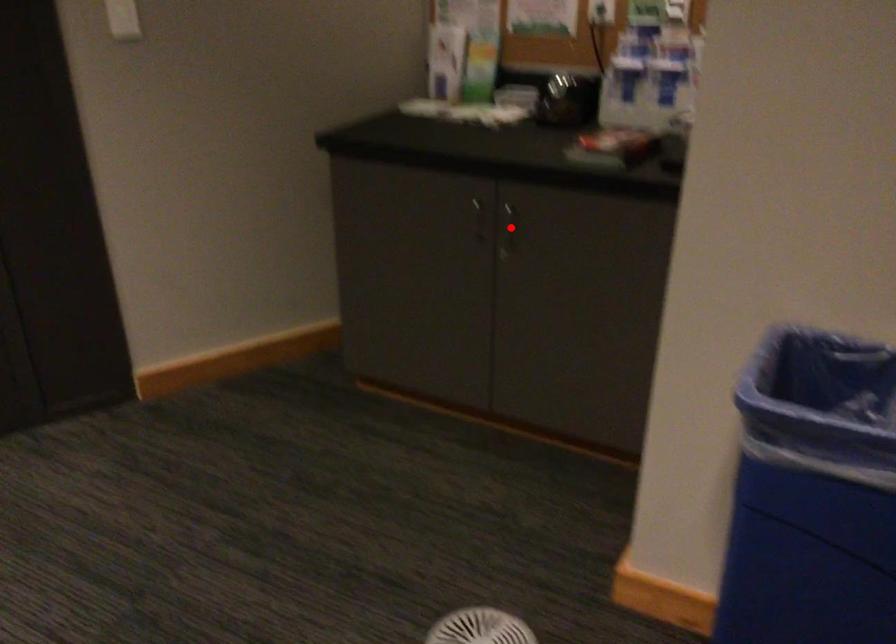
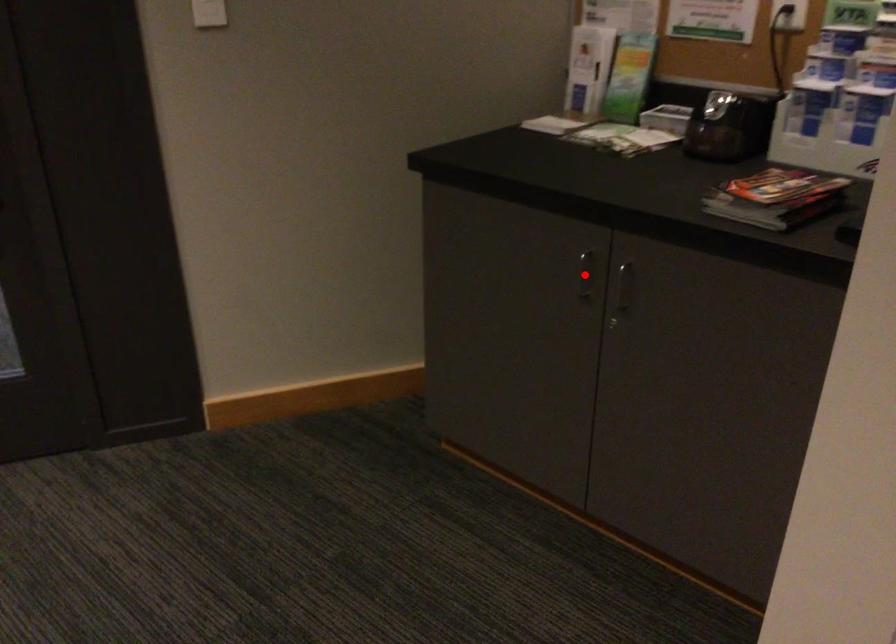
I am providing you with two images of the same scene from different viewpoints. A red point is marked on the first image and another point is marked on the second image. Do the highlighted points in image1 and image2 indicate the same real-world spot?

No